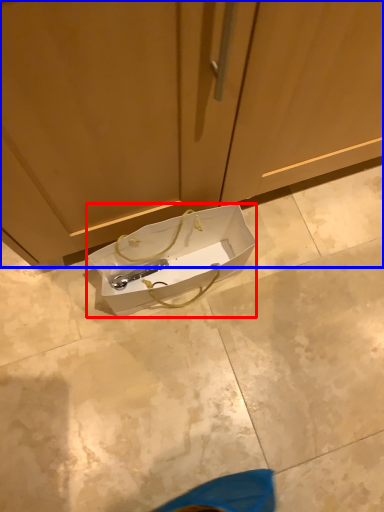
Question: Which object appears closest to the camera in this image, box (highlighted by a red box) or cabinetry (highlighted by a blue box)?

Choices:
 (A) box
 (B) cabinetry

Answer: (B)